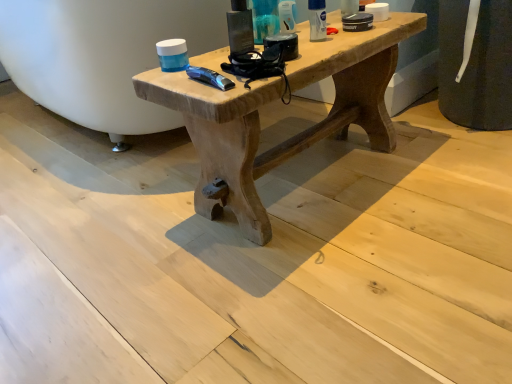
In order to click on free space to the left of natural wood table at center in this screenshot , I will do `click(106, 215)`.